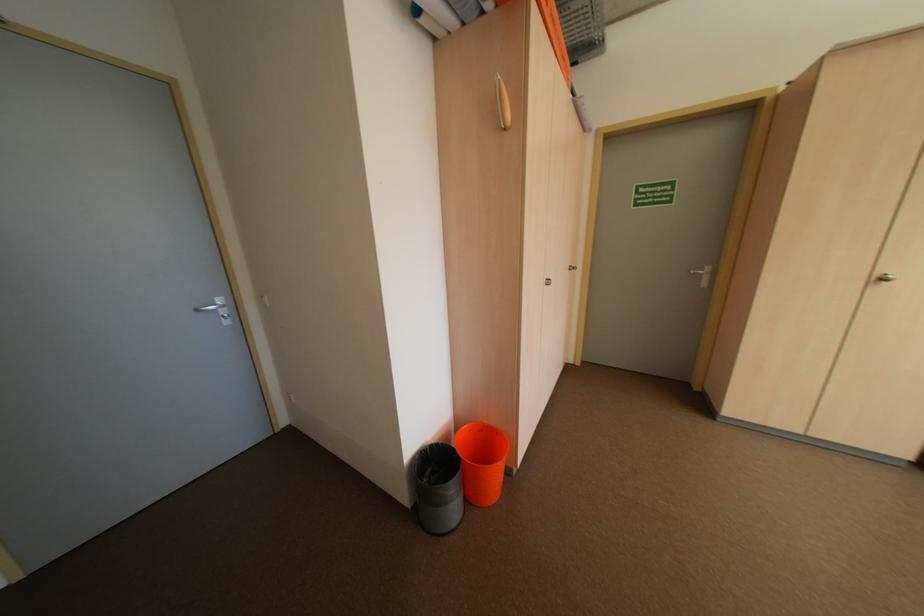
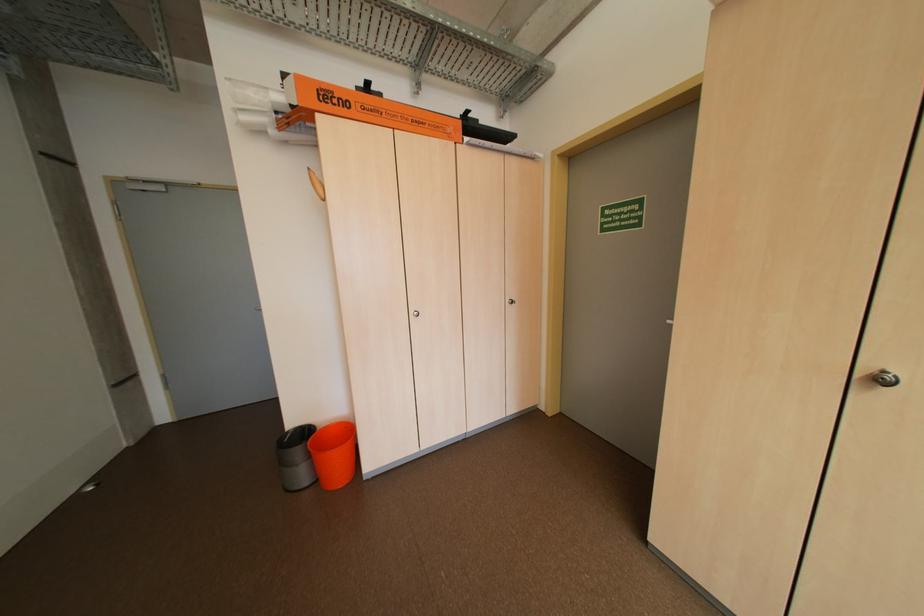
Find the pixel in the second image that matches point (893, 281) in the first image.

(891, 381)